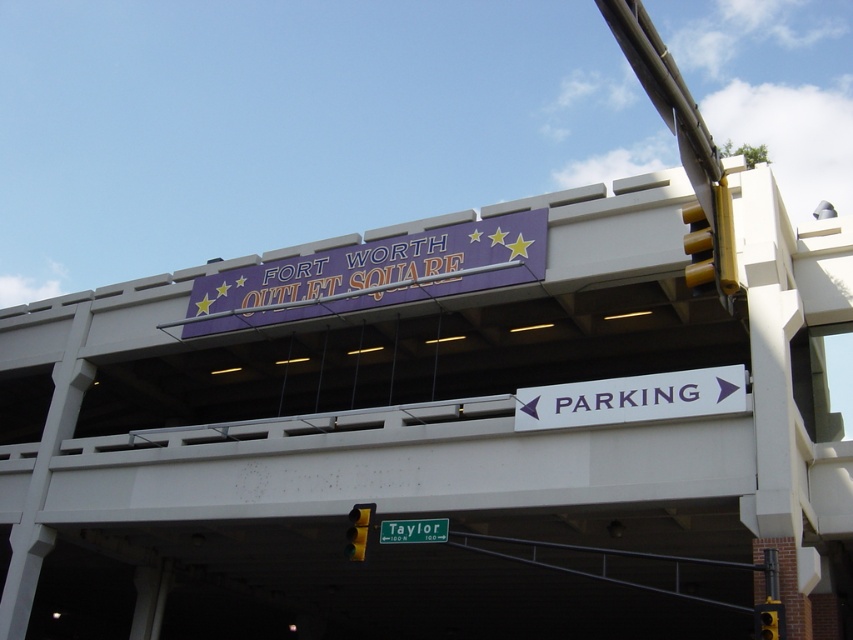
You are a delivery driver approaching the parking area and need to determine which sign to follow first. Since both the white plastic parking sign at lower center and the yellow plastic traffic light at upper right are in your view, which one is narrower and should be noticed first according to standard traffic rules?

The white plastic parking sign at lower center is thinner than the yellow plastic traffic light at upper right. According to standard traffic rules, drivers should prioritize the traffic light, so even though it is wider, you should follow the yellow plastic traffic light at upper right first before considering the white plastic parking sign at lower center.

You are driving a delivery van that is 20 feet long. You need to navigate between the purple glossy sign at upper center and the yellow plastic traffic light at upper right. Can your van fit through the space between them without touching either?

The distance between the purple glossy sign at upper center and the yellow plastic traffic light at upper right is 49.70 feet. Since your van is 20 feet long, there is sufficient space for it to pass through without touching either object.